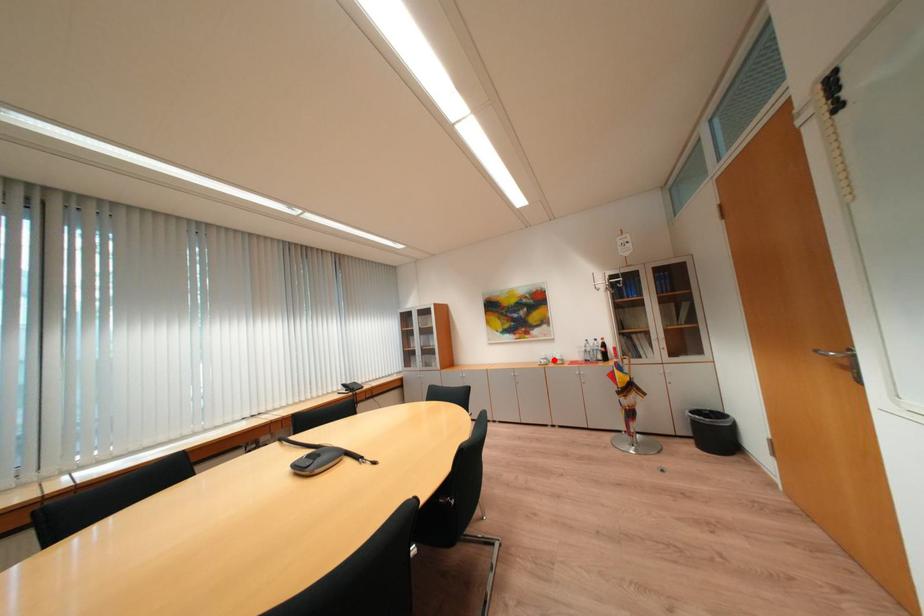
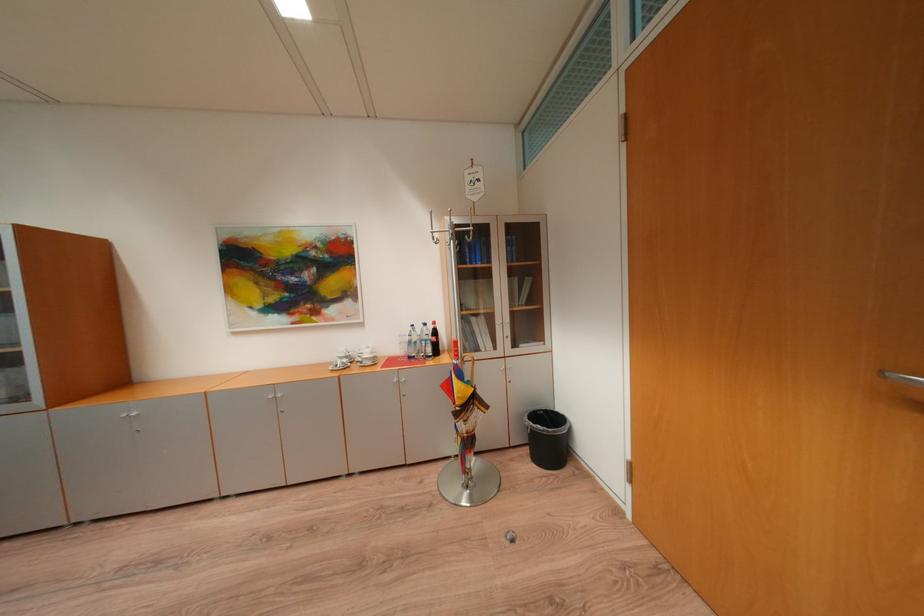
Question: I am providing you with two images of the same scene from different viewpoints. A red point is shown in image1. For the corresponding object point in image2, is it positioned nearer or farther from the camera?

Choices:
 (A) Nearer
 (B) Farther

Answer: (A)